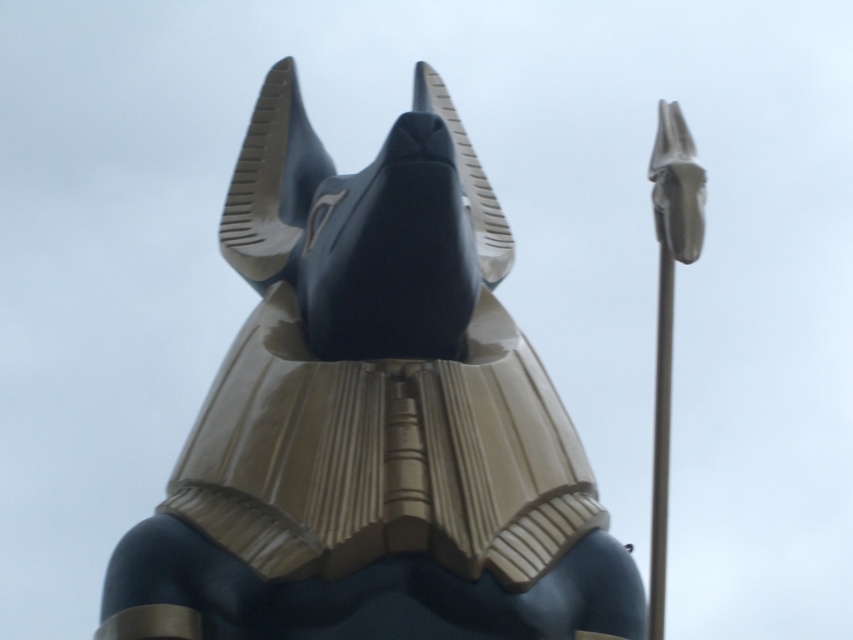
Question: Can you confirm if glossy gold statue at center is smaller than silver metallic pole at right?

Choices:
 (A) yes
 (B) no

Answer: (B)

Question: Which point appears closest to the camera in this image?

Choices:
 (A) (289, 204)
 (B) (660, 269)

Answer: (A)

Question: Which point is closer to the camera taking this photo?

Choices:
 (A) (415, 342)
 (B) (659, 396)

Answer: (A)

Question: Can you confirm if glossy gold statue at center is positioned to the left of silver metallic pole at right?

Choices:
 (A) no
 (B) yes

Answer: (B)

Question: Can you confirm if glossy gold statue at center is smaller than silver metallic pole at right?

Choices:
 (A) no
 (B) yes

Answer: (A)

Question: Among these points, which one is nearest to the camera?

Choices:
 (A) (653, 557)
 (B) (260, 452)

Answer: (B)